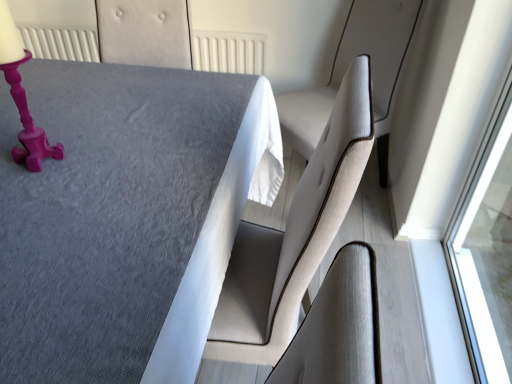
Question: From the image's perspective, is light beige fabric swivel chair at right over matte pink candlestick at upper left?

Choices:
 (A) no
 (B) yes

Answer: (B)

Question: From the image's perspective, would you say light beige fabric swivel chair at right is shown under matte pink candlestick at upper left?

Choices:
 (A) no
 (B) yes

Answer: (A)

Question: Is matte pink candlestick at upper left completely or partially inside light beige fabric swivel chair at right?

Choices:
 (A) no
 (B) yes

Answer: (A)

Question: Is light beige fabric swivel chair at right turned away from matte pink candlestick at upper left?

Choices:
 (A) no
 (B) yes

Answer: (A)

Question: Is light beige fabric swivel chair at right to the left of matte pink candlestick at upper left from the viewer's perspective?

Choices:
 (A) no
 (B) yes

Answer: (A)

Question: Is light beige fabric swivel chair at right next to matte pink candlestick at upper left?

Choices:
 (A) no
 (B) yes

Answer: (A)

Question: Can you confirm if light beige fabric swivel chair at right is thinner than textured gray table at center?

Choices:
 (A) yes
 (B) no

Answer: (B)

Question: From the image's perspective, is light beige fabric swivel chair at right below textured gray table at center?

Choices:
 (A) yes
 (B) no

Answer: (B)

Question: Is light beige fabric swivel chair at right to the left of textured gray table at center from the viewer's perspective?

Choices:
 (A) no
 (B) yes

Answer: (A)

Question: Considering the relative sizes of light beige fabric swivel chair at right and textured gray table at center in the image provided, is light beige fabric swivel chair at right smaller than textured gray table at center?

Choices:
 (A) yes
 (B) no

Answer: (B)

Question: Does light beige fabric swivel chair at right have a greater width compared to textured gray table at center?

Choices:
 (A) no
 (B) yes

Answer: (B)

Question: Is the position of light beige fabric swivel chair at right more distant than that of textured gray table at center?

Choices:
 (A) yes
 (B) no

Answer: (A)

Question: Can you confirm if matte pink candlestick at upper left is taller than textured gray table at center?

Choices:
 (A) no
 (B) yes

Answer: (A)